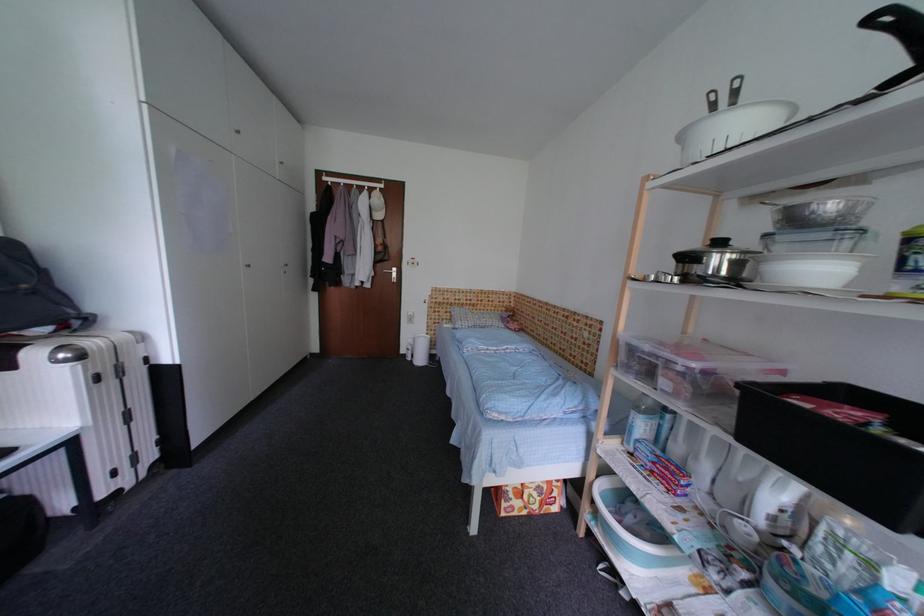
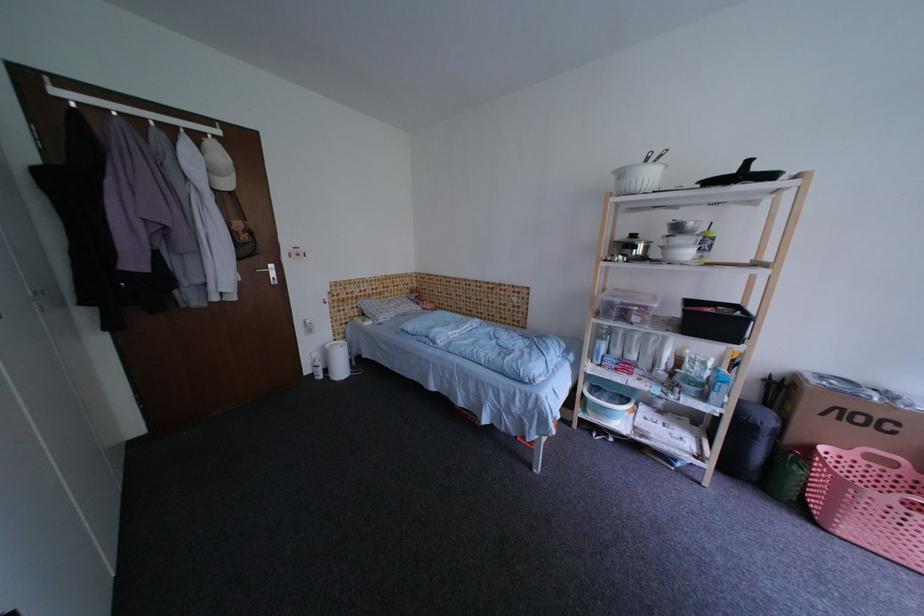
Locate, in the second image, the point that corresponds to the point at 418,350 in the first image.

(326, 366)